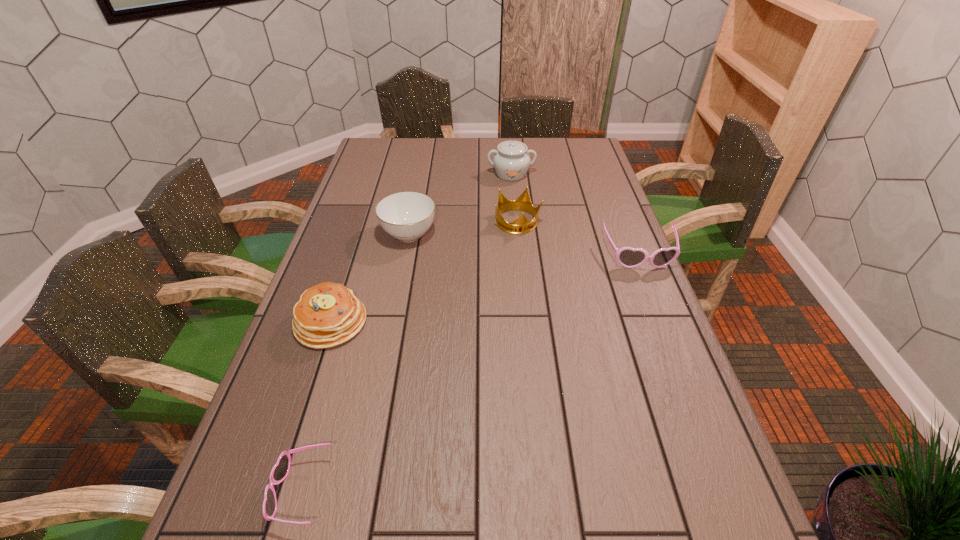
Locate an element on the screen. This screenshot has height=540, width=960. free area in between the right sunglasses and the crown is located at coordinates (578, 239).

Identify the location of unoccupied area between the farthest object and the left chinaware. This screenshot has width=960, height=540. (460, 204).

The height and width of the screenshot is (540, 960). I want to click on free space between the taller sunglasses and the crown, so click(578, 239).

Where is `free space between the nearer sunglasses and the left chinaware`? This screenshot has width=960, height=540. free space between the nearer sunglasses and the left chinaware is located at coordinates (355, 363).

Where is `vacant region between the taller chinaware and the pancake`? The image size is (960, 540). vacant region between the taller chinaware and the pancake is located at coordinates (421, 248).

Find the location of a particular element. free spot between the shortest object and the tallest object is located at coordinates (406, 333).

Locate an element on the screen. vacant region between the crown and the fifth farthest object is located at coordinates (424, 272).

Identify the location of free spot between the taller chinaware and the shorter chinaware. (460, 204).

Identify the location of object that can be found as the closest to the left chinaware. This screenshot has width=960, height=540. (522, 225).

Identify which object is the second closest to the right chinaware. Please provide its 2D coordinates. Your answer should be formatted as a tuple, i.e. [(x, y)], where the tuple contains the x and y coordinates of a point satisfying the conditions above.

[(406, 216)]